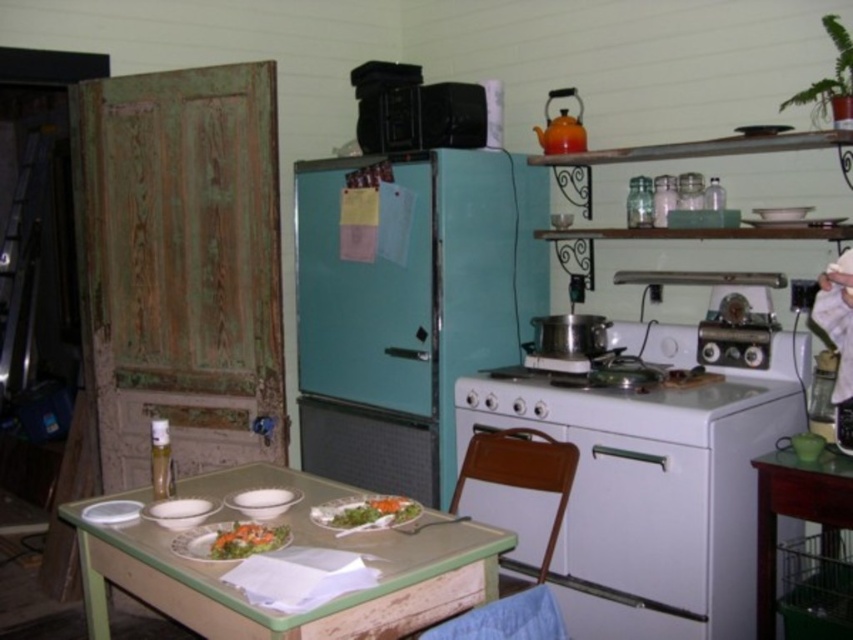
You are organizing a small dinner party and need to prepare a salad. You have green leafy vegetables at center and green leafy salad at table. How far apart are these items from each other?

The green leafy vegetables at center and green leafy salad at table are 8.06 inches apart from each other.

In the scene shown: You are standing in the rustic kitchen and want to grab some greens for your meal. Which of the two options, the green leafy vegetables at center or the green leafy salad at table, is closer to you?

The green leafy vegetables at center is closer to you because it is further to the viewer than the green leafy salad at table.

You are a chef preparing a meal and need to move the green leafy salad at table to the metallic silver exhaust hood at upper center for quick cooling. The chef has a tray that can carry the salad but has a maximum reach of 1.7 meters. Can the chef move the salad to the exhaust hood without needing to step closer?

The distance between the metallic silver exhaust hood at upper center and the green leafy salad at table is 1.81 meters. Since the chef can only reach 1.7 meters, they would need to step closer to bridge the gap of 0.11 meters to move the salad to the exhaust hood.